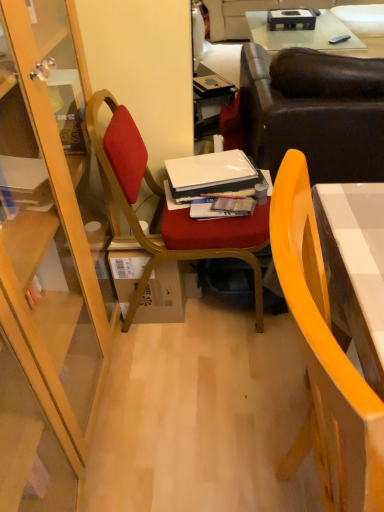
Question: Looking at the image, does brown cardboard box at center seem bigger or smaller compared to matte wood chair at center, the 1th chair viewed from the back?

Choices:
 (A) small
 (B) big

Answer: (A)

Question: Would you say brown cardboard box at center is to the left or to the right of matte wood chair at center, which appears as the 2th chair when viewed from the front, in the picture?

Choices:
 (A) left
 (B) right

Answer: (A)

Question: Which object is positioned farthest from the leather couch at upper right?

Choices:
 (A) matte yellow chair at right, arranged as the 2th chair when viewed from the back
 (B) matte paper magazine at center
 (C) leather couch at upper center
 (D) matte wood chair at center, which appears as the 2th chair when viewed from the front
 (E) brown cardboard box at center

Answer: (C)

Question: Based on their relative distances, which object is nearer to the leather couch at upper center?

Choices:
 (A) leather couch at upper right
 (B) matte yellow chair at right, the first chair in the front-to-back sequence
 (C) brown cardboard box at center
 (D) matte paper magazine at center
 (E) matte wood chair at center, the 1th chair viewed from the back

Answer: (A)